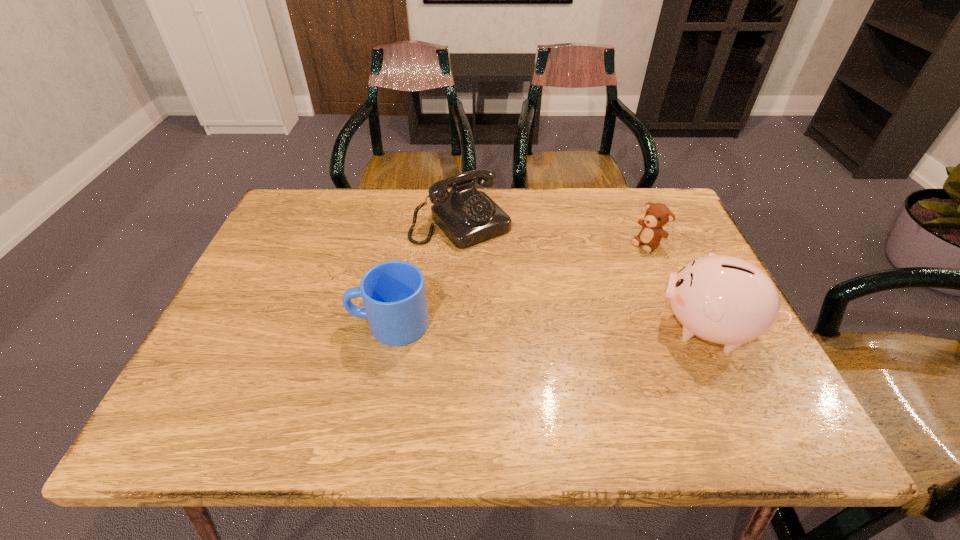
The width and height of the screenshot is (960, 540). In order to click on vacant space on the desktop that is between the mug and the piggy bank and is positioned on the dial of the telephone in this screenshot , I will do `click(553, 326)`.

This screenshot has width=960, height=540. Find the location of `free space on the desktop that is between the mug and the tallest object and is positioned on the face of the teddy bear`. free space on the desktop that is between the mug and the tallest object and is positioned on the face of the teddy bear is located at coordinates (535, 326).